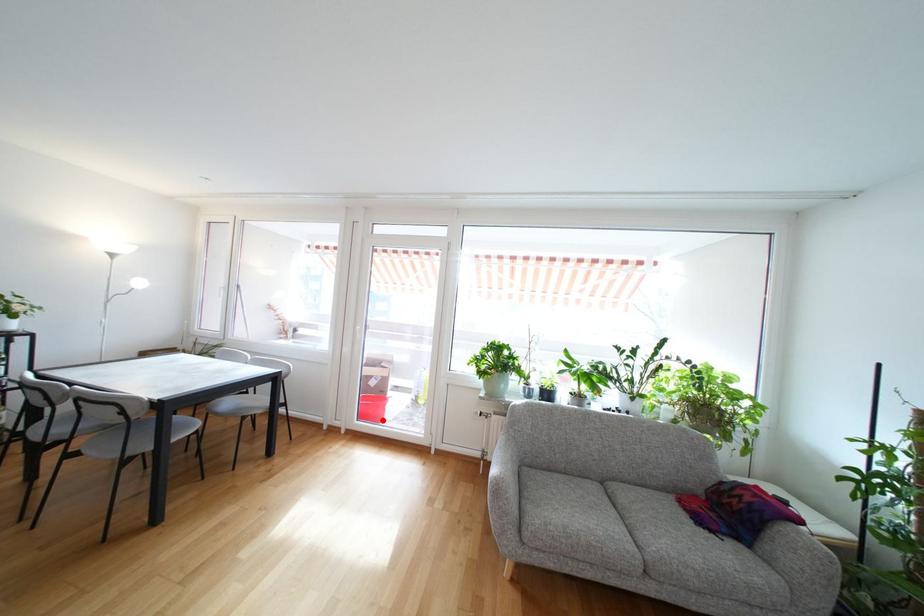
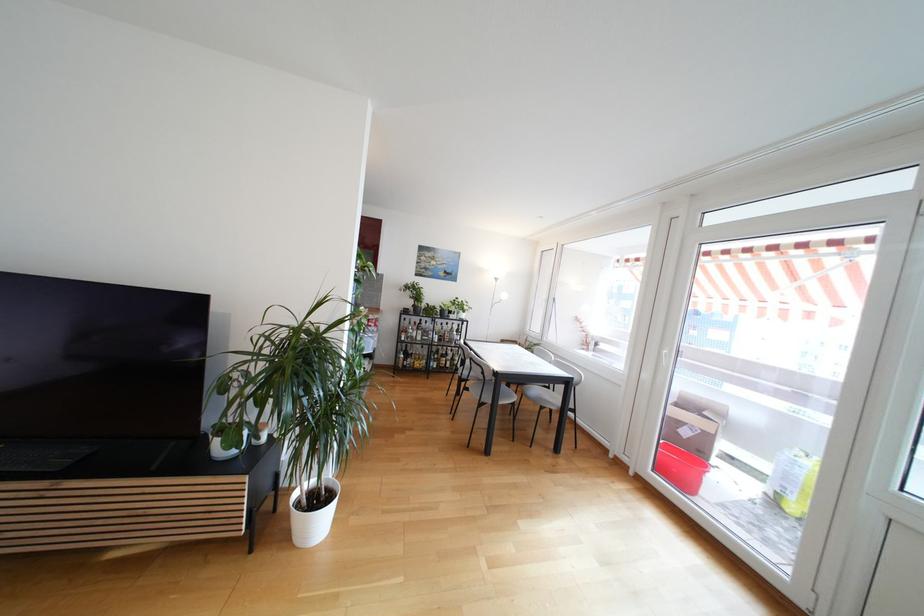
Question: I am providing you with two images of the same scene from different viewpoints. A red point is shown in image1. For the corresponding object point in image2, is it positioned nearer or farther from the camera?

Choices:
 (A) Nearer
 (B) Farther

Answer: (A)